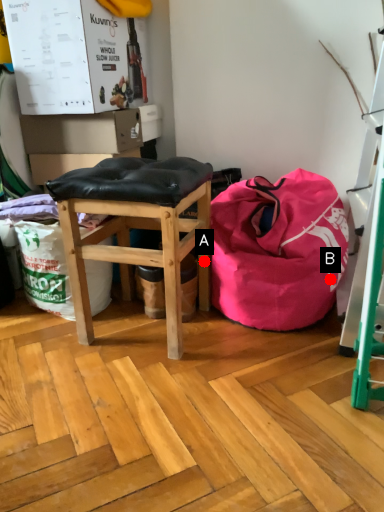
Question: Two points are circled on the image, labeled by A and B beside each circle. Which point is farther to the camera?

Choices:
 (A) A is further
 (B) B is further

Answer: (A)